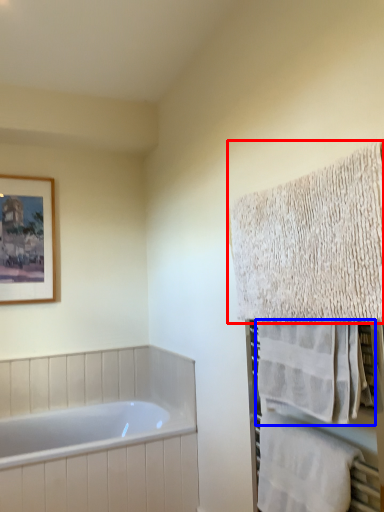
Question: Which point is closer to the camera, towel (highlighted by a red box) or towel (highlighted by a blue box)?

Choices:
 (A) towel
 (B) towel

Answer: (A)